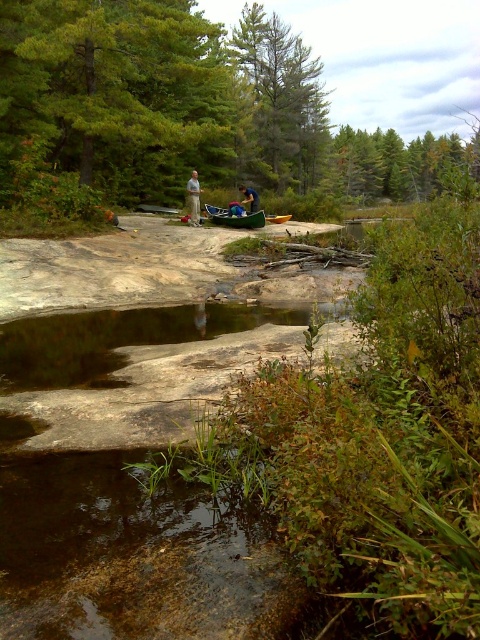
Question: Can you confirm if green matte tree at upper center is positioned below yellow plastic canoe at center?

Choices:
 (A) no
 (B) yes

Answer: (A)

Question: Which point is farther to the camera?

Choices:
 (A) (225, 216)
 (B) (193, 193)
 (C) (287, 212)
 (D) (128, 108)

Answer: (C)

Question: Is green leafy tree at upper center closer to the viewer compared to green fabric backpack at center?

Choices:
 (A) yes
 (B) no

Answer: (B)

Question: Which point is closer to the camera?

Choices:
 (A) green matte canoe at center
 (B) green matte tree at upper center
 (C) light brown fabric pants at center
 (D) green fabric backpack at center

Answer: (C)

Question: Is green leafy tree at upper left to the right of green matte canoe at center from the viewer's perspective?

Choices:
 (A) yes
 (B) no

Answer: (B)

Question: Which of these objects is positioned closest to the green matte canoe at center?

Choices:
 (A) green leafy tree at upper left
 (B) green fabric backpack at center
 (C) green leafy tree at upper center
 (D) light brown fabric pants at center

Answer: (B)